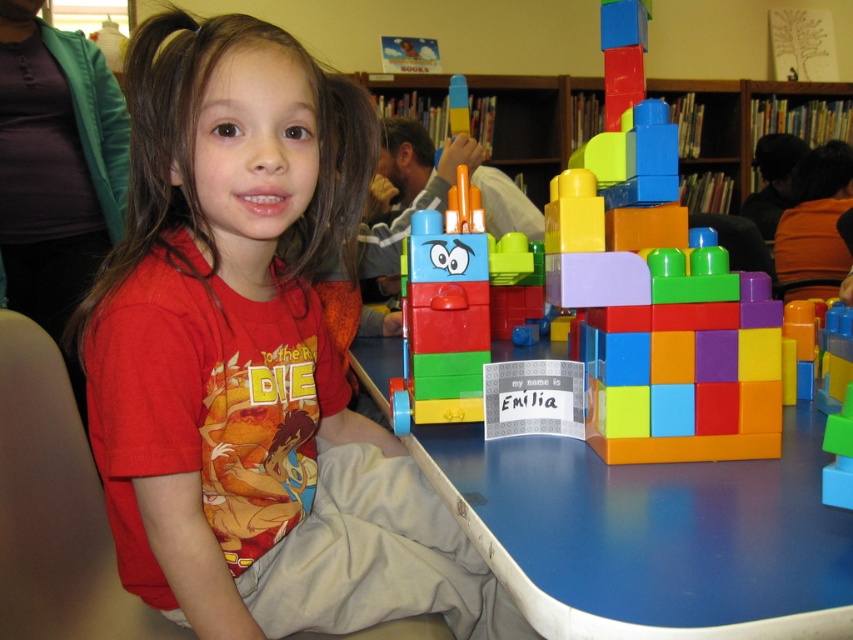
Question: Which point appears farthest from the camera in this image?

Choices:
 (A) pos(749,420)
 (B) pos(775,506)
 (C) pos(225,282)

Answer: (C)

Question: Can you confirm if blue plastic table at center is positioned to the left of multicolored plastic blocks at center?

Choices:
 (A) yes
 (B) no

Answer: (A)

Question: Can you confirm if matte red shirt at center is positioned above blue plastic table at center?

Choices:
 (A) no
 (B) yes

Answer: (B)

Question: Estimate the real-world distances between objects in this image. Which object is farther from the matte red shirt at center?

Choices:
 (A) blue plastic table at center
 (B) multicolored plastic blocks at center

Answer: (B)

Question: Based on their relative distances, which object is nearer to the multicolored plastic blocks at center?

Choices:
 (A) blue plastic table at center
 (B) matte red shirt at center

Answer: (A)

Question: Can you confirm if matte red shirt at center is bigger than blue plastic table at center?

Choices:
 (A) no
 (B) yes

Answer: (B)